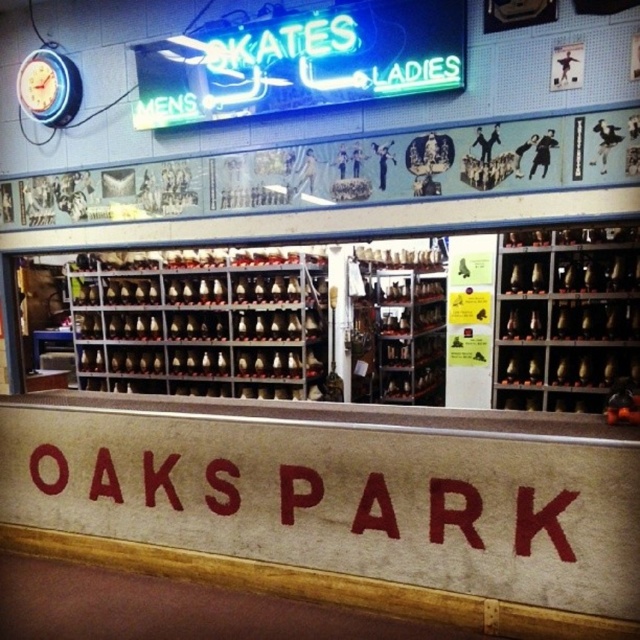
Question: Which object appears farthest from the camera in this image?

Choices:
 (A) metallic silver skates at center
 (B) red painted sign at center
 (C) metallic gold skates at right

Answer: (A)

Question: In this image, where is metallic silver skates at center located relative to metallic gold skates at right?

Choices:
 (A) below
 (B) above

Answer: (A)

Question: Where is metallic silver skates at center located in relation to red painted sign at center in the image?

Choices:
 (A) below
 (B) above

Answer: (B)

Question: Which is farther from the neon green sign at upper center?

Choices:
 (A) metallic silver skates at center
 (B) red painted sign at center
 (C) metallic gold skates at right

Answer: (A)

Question: Which point is closer to the camera taking this photo?

Choices:
 (A) (228, 458)
 (B) (100, 380)

Answer: (A)

Question: Considering the relative positions of neon green sign at upper center and metallic gold skates at right in the image provided, where is neon green sign at upper center located with respect to metallic gold skates at right?

Choices:
 (A) below
 (B) above

Answer: (B)